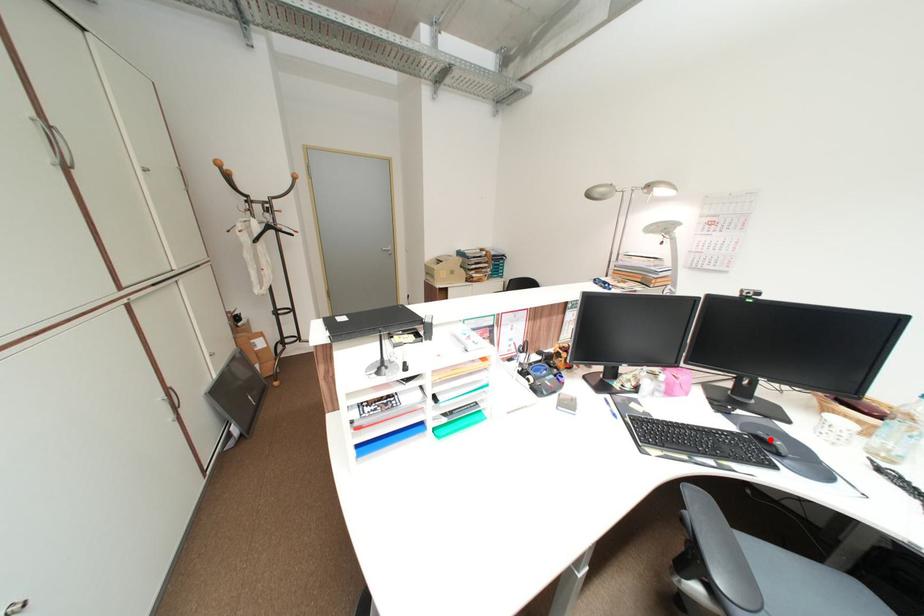
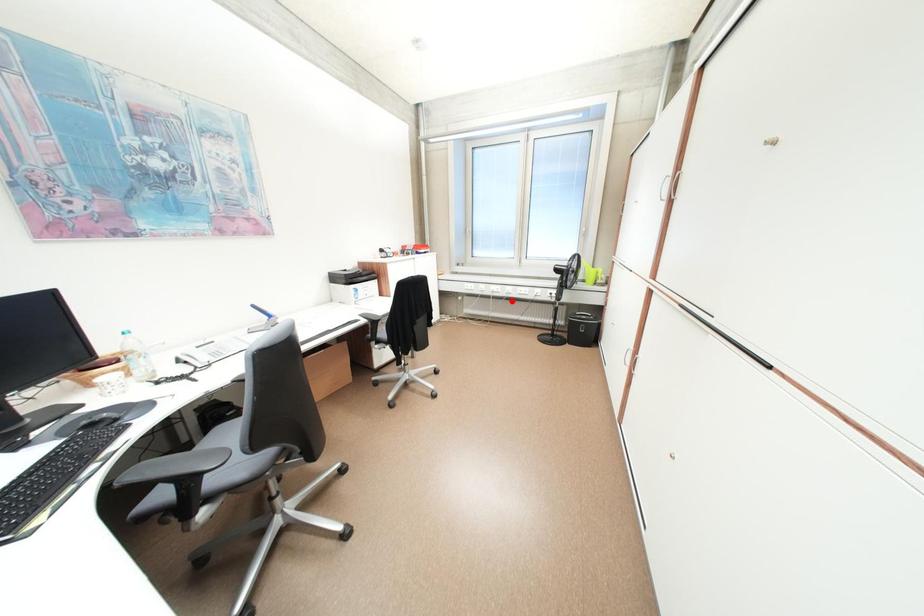
I am providing you with two images of the same scene from different viewpoints. A red point is marked on the first image and another point is marked on the second image. Do the highlighted points in image1 and image2 indicate the same real-world spot?

No